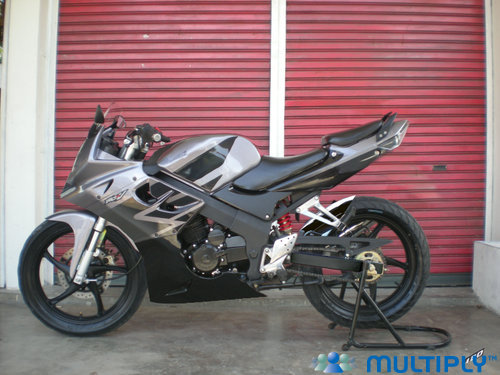
Identify the location of stand. (361, 309).